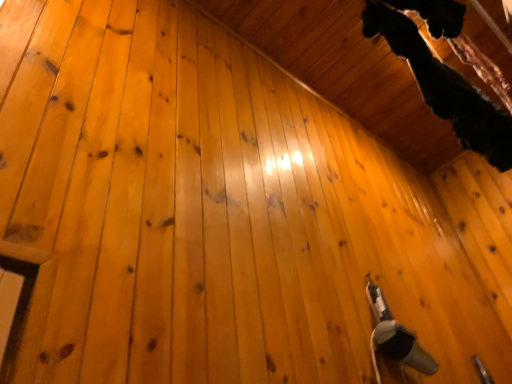
You are a GUI agent. You are given a task and a screenshot of the screen. Output one action in this format:
    pyautogui.click(x=<x>, y=<y>)
    Task: Click on the black fur at upper right
    This screenshot has height=384, width=512.
    Given the screenshot: What is the action you would take?
    pyautogui.click(x=445, y=87)

The height and width of the screenshot is (384, 512). Describe the element at coordinates (445, 87) in the screenshot. I see `black fur at upper right` at that location.

What is the approximate height of black fur at upper right?

black fur at upper right is 18.83 inches tall.

This screenshot has width=512, height=384. Identify the location of black fur at upper right. (445, 87).